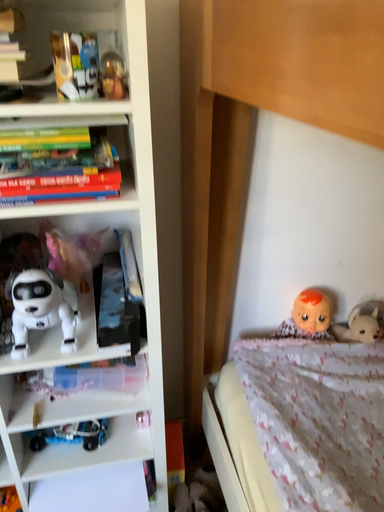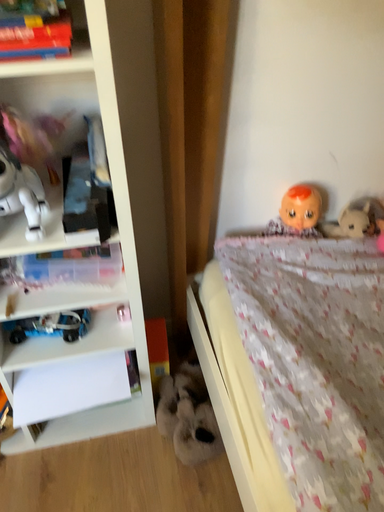
Question: Which way did the camera rotate in the video?

Choices:
 (A) rotated upward
 (B) rotated downward

Answer: (B)